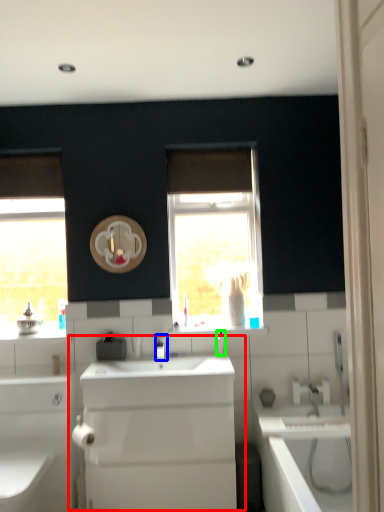
Question: Considering the real-world distances, which object is farthest from sink (highlighted by a red box)? tap (highlighted by a blue box) or toiletry (highlighted by a green box)?

Choices:
 (A) tap
 (B) toiletry

Answer: (B)